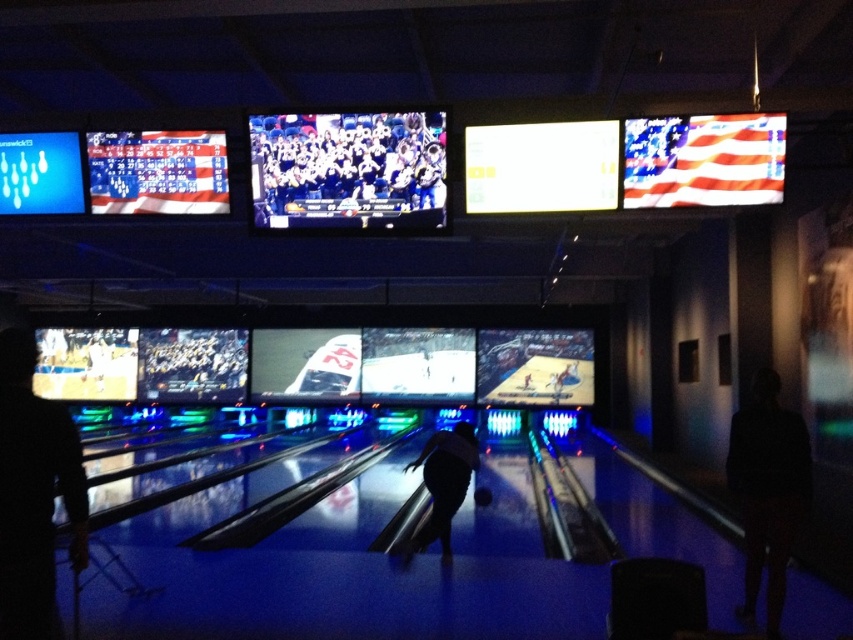
Question: Which object appears closest to the camera in this image?

Choices:
 (A) white fabric group at center
 (B) black fabric at left
 (C) dark fabric at right
 (D) silhouette bowling ball at center

Answer: (B)

Question: Considering the real-world distances, which object is closest to the dark fabric at right?

Choices:
 (A) black fabric at left
 (B) white fabric group at center
 (C) silhouette bowling ball at center

Answer: (C)

Question: Where is dark fabric at right located in relation to silhouette bowling ball at center in the image?

Choices:
 (A) left
 (B) right

Answer: (B)

Question: Which of the following is the farthest from the observer?

Choices:
 (A) dark fabric at right
 (B) white fabric group at center
 (C) silhouette bowling ball at center
 (D) black fabric at left

Answer: (C)

Question: Is white fabric group at center thinner than dark fabric at right?

Choices:
 (A) no
 (B) yes

Answer: (A)

Question: Is white fabric group at center thinner than silhouette bowling ball at center?

Choices:
 (A) yes
 (B) no

Answer: (B)